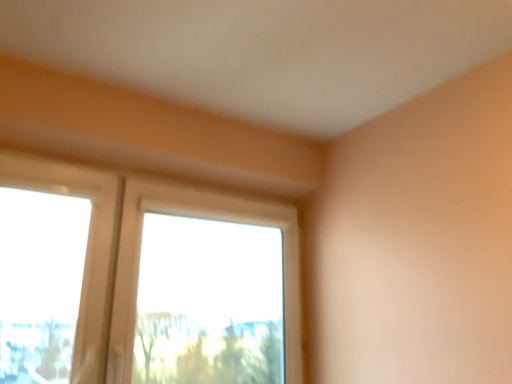
Question: From the image's perspective, is transparent plastic window screen at left on top of clear glass window at center?

Choices:
 (A) yes
 (B) no

Answer: (A)

Question: Is transparent plastic window screen at left to the right of clear glass window at center from the viewer's perspective?

Choices:
 (A) no
 (B) yes

Answer: (A)

Question: From a real-world perspective, is transparent plastic window screen at left located beneath clear glass window at center?

Choices:
 (A) no
 (B) yes

Answer: (A)

Question: Is transparent plastic window screen at left at the left side of clear glass window at center?

Choices:
 (A) no
 (B) yes

Answer: (B)

Question: Is transparent plastic window screen at left positioned behind clear glass window at center?

Choices:
 (A) no
 (B) yes

Answer: (A)

Question: Is transparent plastic window screen at left bigger than clear glass window at center?

Choices:
 (A) yes
 (B) no

Answer: (B)

Question: Considering the relative sizes of clear glass window at center and transparent plastic window screen at left in the image provided, is clear glass window at center shorter than transparent plastic window screen at left?

Choices:
 (A) yes
 (B) no

Answer: (B)

Question: Does clear glass window at center have a greater height compared to transparent plastic window screen at left?

Choices:
 (A) yes
 (B) no

Answer: (A)

Question: Are clear glass window at center and transparent plastic window screen at left far apart?

Choices:
 (A) no
 (B) yes

Answer: (A)

Question: Is clear glass window at center bigger than transparent plastic window screen at left?

Choices:
 (A) yes
 (B) no

Answer: (A)

Question: From the image's perspective, does clear glass window at center appear higher than transparent plastic window screen at left?

Choices:
 (A) no
 (B) yes

Answer: (A)

Question: Is clear glass window at center wider than transparent plastic window screen at left?

Choices:
 (A) no
 (B) yes

Answer: (B)

Question: Considering the positions of point (287, 294) and point (20, 258), is point (287, 294) closer or farther from the camera than point (20, 258)?

Choices:
 (A) farther
 (B) closer

Answer: (A)